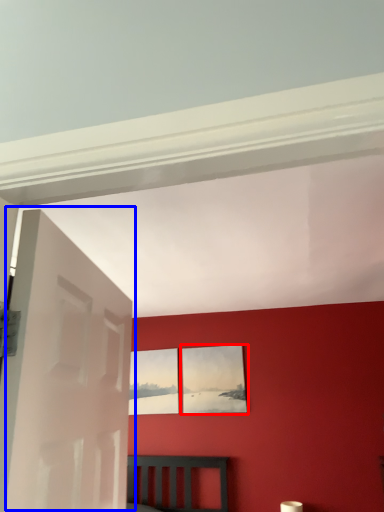
Question: Among these objects, which one is nearest to the camera, picture frame (highlighted by a red box) or door (highlighted by a blue box)?

Choices:
 (A) picture frame
 (B) door

Answer: (B)